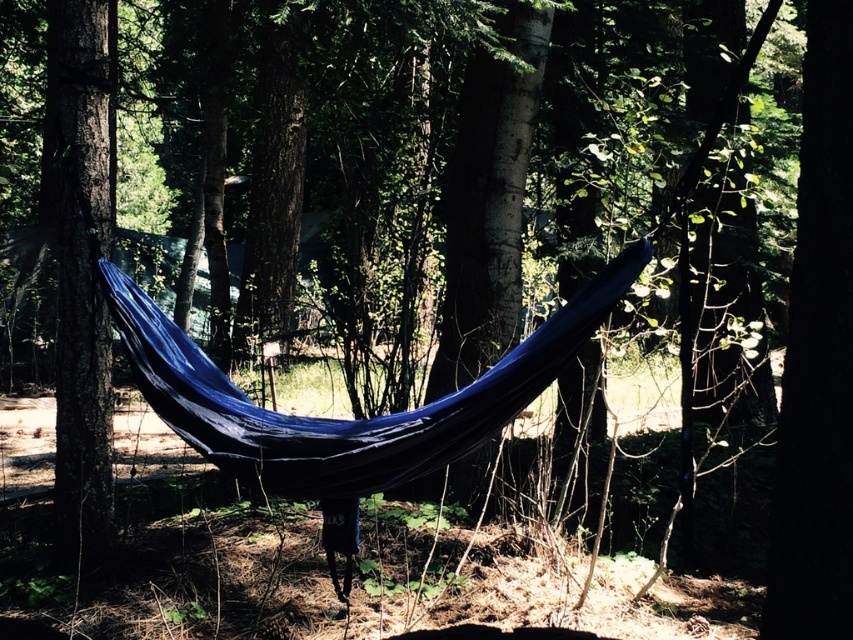
Question: Considering the real-world distances, which object is closest to the blue fabric hammock at center?

Choices:
 (A) dark brown wood tree at left
 (B) dark brown wood at center

Answer: (B)

Question: Does dark brown wood at center have a larger size compared to dark brown wood tree at left?

Choices:
 (A) yes
 (B) no

Answer: (B)

Question: Among these objects, which one is farthest from the camera?

Choices:
 (A) dark brown wood tree at left
 (B) blue fabric hammock at center

Answer: (A)

Question: Can you confirm if dark brown wood at center is positioned below blue fabric hammock at center?

Choices:
 (A) yes
 (B) no

Answer: (B)

Question: Which is nearer to the blue fabric hammock at center?

Choices:
 (A) dark brown wood at center
 (B) dark brown wood tree at left

Answer: (A)

Question: Can you confirm if dark brown wood at center is positioned below dark brown wood tree at left?

Choices:
 (A) yes
 (B) no

Answer: (A)